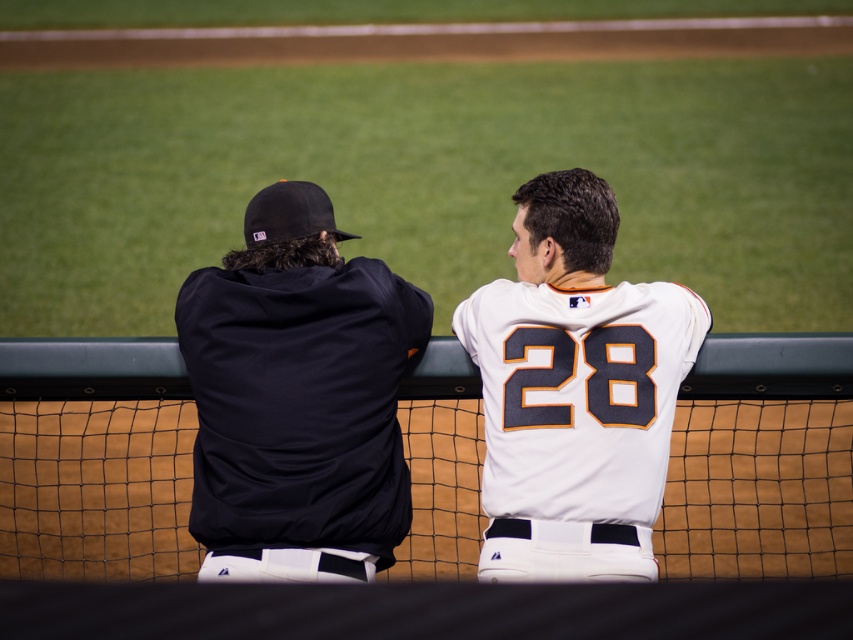
Question: Does dark blue jersey at left appear under white jersey at center?

Choices:
 (A) no
 (B) yes

Answer: (A)

Question: Which point is farther from the camera taking this photo?

Choices:
 (A) (633, 355)
 (B) (337, 250)

Answer: (B)

Question: Among these objects, which one is farthest from the camera?

Choices:
 (A) dark blue jersey at left
 (B) white jersey at center

Answer: (B)

Question: Is dark blue jersey at left behind white jersey at center?

Choices:
 (A) yes
 (B) no

Answer: (B)

Question: Observing the image, what is the correct spatial positioning of dark blue jersey at left in reference to white jersey at center?

Choices:
 (A) right
 (B) left

Answer: (B)